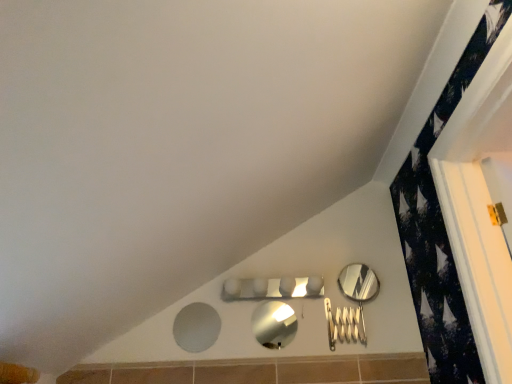
Question: Is matte gray mirror at lower center, the third mirror positioned from the right, at the right side of polished silver mirror at right, which appears as the 1th mirror when viewed from the right?

Choices:
 (A) no
 (B) yes

Answer: (A)

Question: Is matte gray mirror at lower center, the 1th mirror positioned from the left, not within polished silver mirror at right, the third mirror in the left-to-right sequence?

Choices:
 (A) no
 (B) yes

Answer: (B)

Question: Does matte gray mirror at lower center, the 1th mirror positioned from the left, have a lesser height compared to polished silver mirror at right, the third mirror in the left-to-right sequence?

Choices:
 (A) no
 (B) yes

Answer: (A)

Question: Is matte gray mirror at lower center, the third mirror positioned from the right, positioned far away from polished silver mirror at right, which appears as the 1th mirror when viewed from the right?

Choices:
 (A) yes
 (B) no

Answer: (B)

Question: From a real-world perspective, does matte gray mirror at lower center, the third mirror positioned from the right, sit lower than polished silver mirror at right, which appears as the 1th mirror when viewed from the right?

Choices:
 (A) no
 (B) yes

Answer: (B)

Question: Can polished silver mirror at right, the third mirror in the left-to-right sequence, be found inside matte gray mirror at lower center, the third mirror positioned from the right?

Choices:
 (A) no
 (B) yes

Answer: (A)

Question: Is polished silver mirror at right, the third mirror in the left-to-right sequence, touching metallic silver mirror at center, which is the 2th mirror in left-to-right order?

Choices:
 (A) yes
 (B) no

Answer: (B)

Question: Is metallic silver mirror at center, the second mirror in the right-to-left sequence, inside polished silver mirror at right, which appears as the 1th mirror when viewed from the right?

Choices:
 (A) no
 (B) yes

Answer: (A)

Question: Does polished silver mirror at right, the third mirror in the left-to-right sequence, appear on the left side of metallic silver mirror at center, which is the 2th mirror in left-to-right order?

Choices:
 (A) no
 (B) yes

Answer: (A)

Question: Considering the relative positions of polished silver mirror at right, which appears as the 1th mirror when viewed from the right, and metallic silver mirror at center, which is the 2th mirror in left-to-right order, in the image provided, is polished silver mirror at right, which appears as the 1th mirror when viewed from the right, in front of metallic silver mirror at center, which is the 2th mirror in left-to-right order,?

Choices:
 (A) yes
 (B) no

Answer: (B)

Question: Could you tell me if polished silver mirror at right, the third mirror in the left-to-right sequence, is facing metallic silver mirror at center, the second mirror in the right-to-left sequence?

Choices:
 (A) yes
 (B) no

Answer: (B)

Question: Does polished silver mirror at right, the third mirror in the left-to-right sequence, lie behind metallic silver mirror at center, the second mirror in the right-to-left sequence?

Choices:
 (A) no
 (B) yes

Answer: (B)

Question: Considering the relative sizes of metallic silver mirror at center, the second mirror in the right-to-left sequence, and polished silver mirror at right, the third mirror in the left-to-right sequence, in the image provided, is metallic silver mirror at center, the second mirror in the right-to-left sequence, shorter than polished silver mirror at right, the third mirror in the left-to-right sequence,?

Choices:
 (A) no
 (B) yes

Answer: (B)